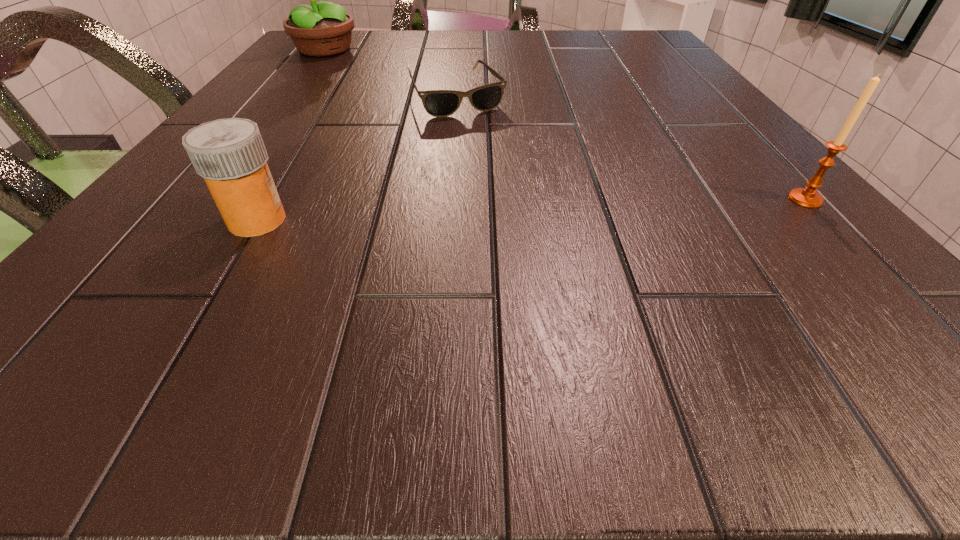
Where is `vacant position in the image that satisfies the following two spatial constraints: 1. on the front side of the shortest object; 2. on the right side of the tallest object`? vacant position in the image that satisfies the following two spatial constraints: 1. on the front side of the shortest object; 2. on the right side of the tallest object is located at coordinates point(289,97).

Locate an element on the screen. This screenshot has height=540, width=960. vacant area in the image that satisfies the following two spatial constraints: 1. on the front side of the third nearest object; 2. on the right side of the tallest object is located at coordinates (289, 97).